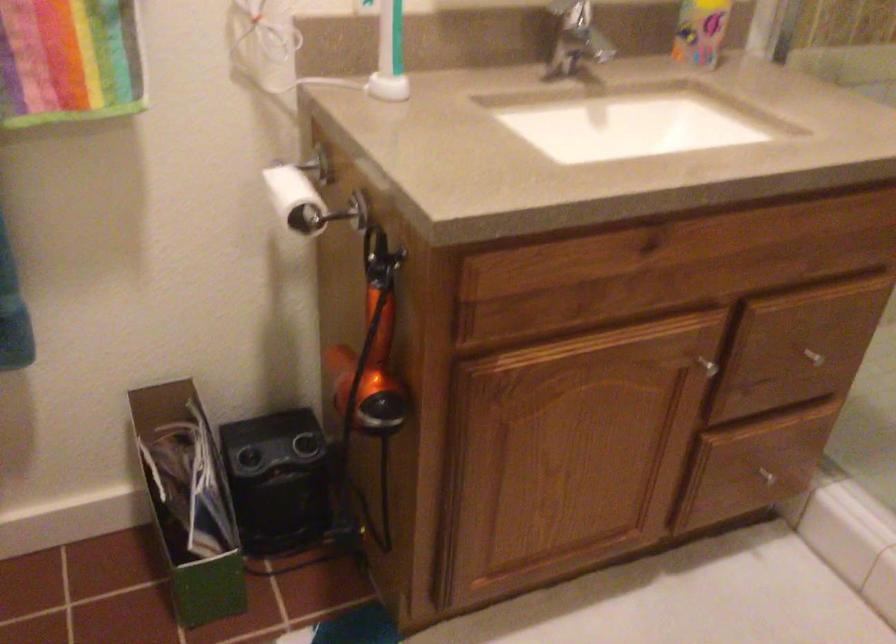
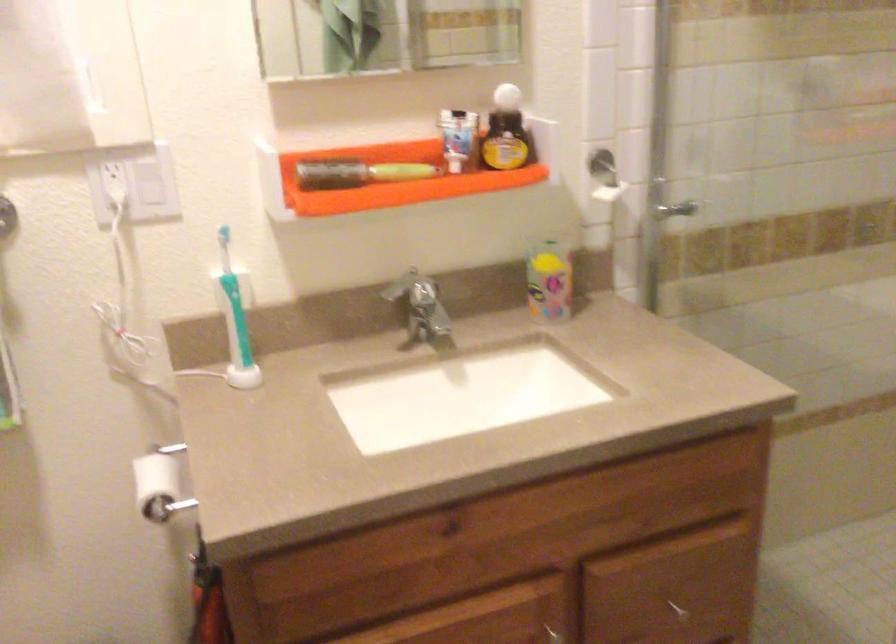
Question: The first image is from the beginning of the video and the second image is from the end. How did the camera likely rotate when shooting the video?

Choices:
 (A) Left
 (B) Right
 (C) Up
 (D) Down

Answer: (C)